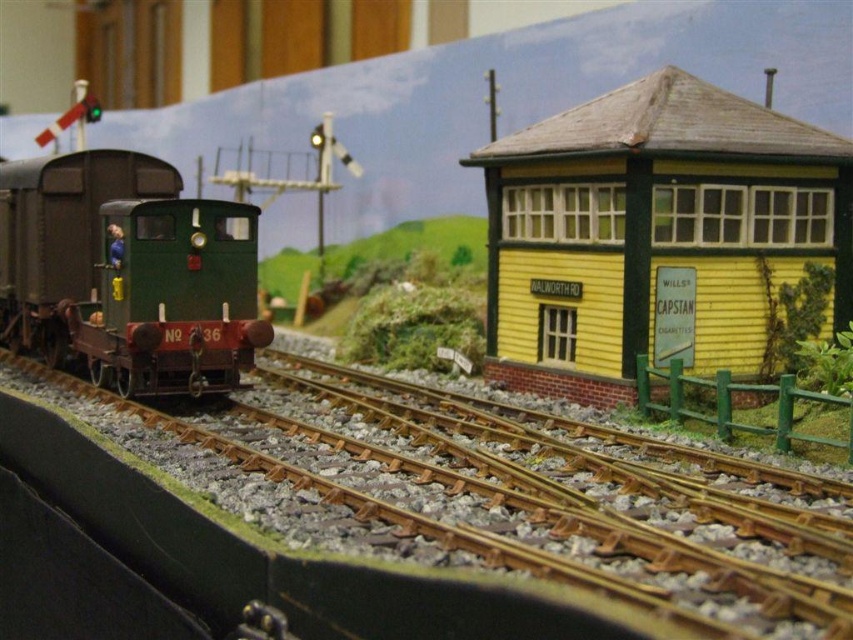
Does brown gravel train track at center have a lesser width compared to yellow wood railway station at right?

No.

Does brown gravel train track at center have a larger size compared to yellow wood railway station at right?

Yes.

You are a GUI agent. You are given a task and a screenshot of the screen. Output one action in this format:
    pyautogui.click(x=<x>, y=<y>)
    Task: Click on the brown gravel train track at center
    
    Given the screenshot: What is the action you would take?
    click(440, 509)

Locate an element on the screen. This screenshot has width=853, height=640. brown gravel train track at center is located at coordinates (440, 509).

Which is above, brown gravel train track at center or matte green locomotive at left?

matte green locomotive at left is higher up.

At what (x,y) coordinates should I click in order to perform the action: click on brown gravel train track at center. Please return your answer as a coordinate pair (x, y). The width and height of the screenshot is (853, 640). Looking at the image, I should click on (440, 509).

What do you see at coordinates (440, 509) in the screenshot? I see `brown gravel train track at center` at bounding box center [440, 509].

You are a GUI agent. You are given a task and a screenshot of the screen. Output one action in this format:
    pyautogui.click(x=<x>, y=<y>)
    Task: Click on the brown gravel train track at center
    
    Given the screenshot: What is the action you would take?
    pyautogui.click(x=440, y=509)

What do you see at coordinates (653, 232) in the screenshot? This screenshot has height=640, width=853. I see `yellow wood railway station at right` at bounding box center [653, 232].

Find the location of `yellow wood railway station at right`. yellow wood railway station at right is located at coordinates (653, 232).